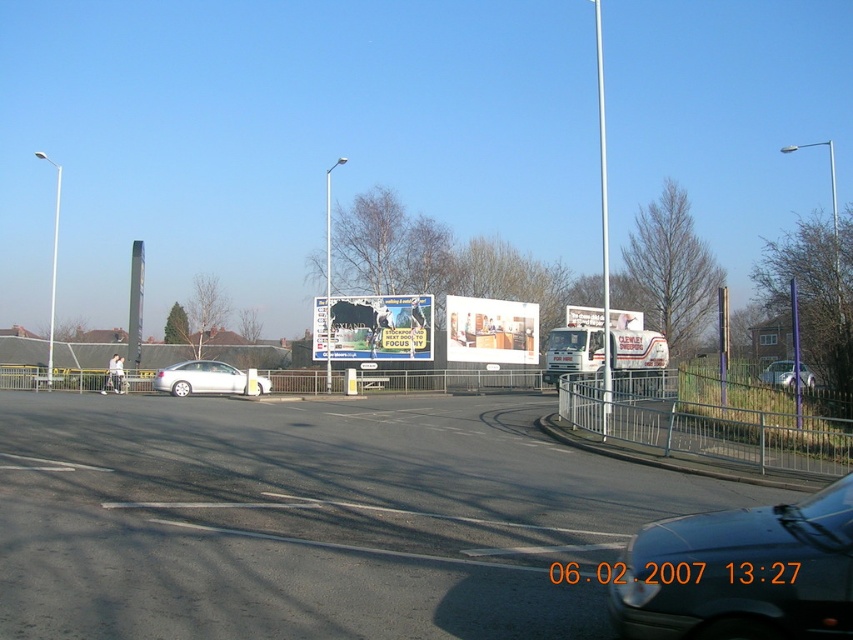
You are a delivery driver who needs to deliver a package to the white glossy kitchen at center. The matte white billboard at center is blocking your path. Can you go around the billboard to reach the kitchen?

The white glossy kitchen at center is positioned under the matte white billboard at center, so you cannot go around the billboard to reach the kitchen since it is directly above it.

You are a delivery person trying to park your van in the area shown. The shiny black car at lower right and the white glossy kitchen at center are in your way. Which object is blocking your path more directly?

The shiny black car at lower right is positioned under the white glossy kitchen at center, so the shiny black car at lower right is directly blocking the path more than the white glossy kitchen at center.